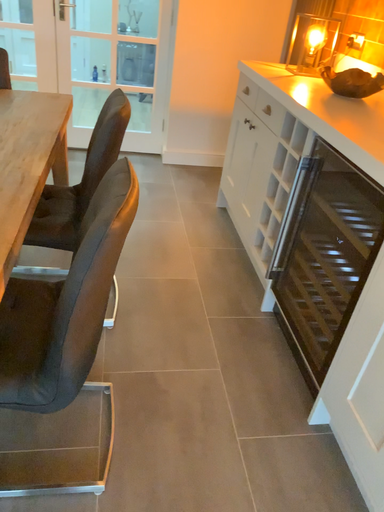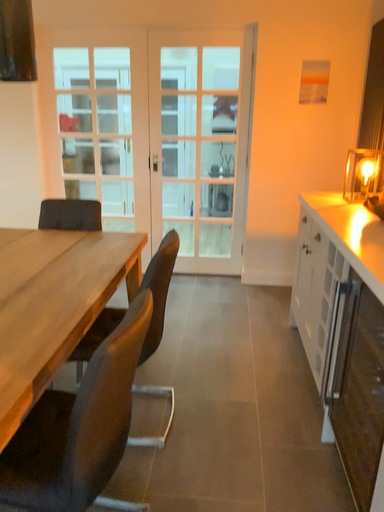
Question: How did the camera likely rotate when shooting the video?

Choices:
 (A) rotated left
 (B) rotated right

Answer: (A)